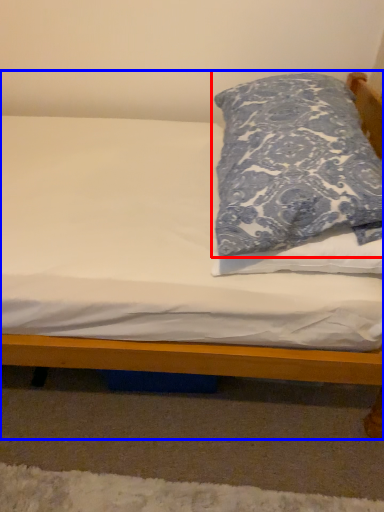
Question: Which point is further to the camera, pillow (highlighted by a red box) or bed (highlighted by a blue box)?

Choices:
 (A) pillow
 (B) bed

Answer: (B)